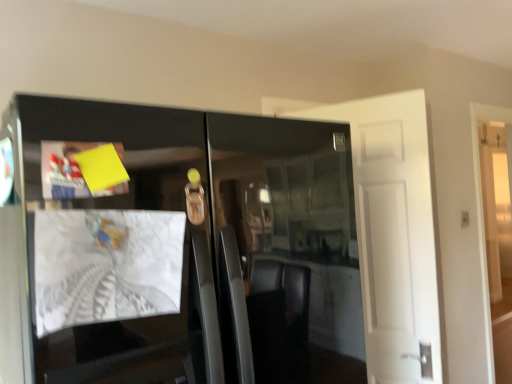
What is the approximate height of yellow paper at upper left, the first magazine from the top?

yellow paper at upper left, the first magazine from the top, is 4.24 inches in height.

At what (x,y) coordinates should I click in order to perform the action: click on white paper at left, placed as the second magazine when sorted from top to bottom. Please return your answer as a coordinate pair (x, y). Looking at the image, I should click on (106, 266).

You are a GUI agent. You are given a task and a screenshot of the screen. Output one action in this format:
    pyautogui.click(x=<x>, y=<y>)
    Task: Click on the yellow paper at upper left, the first magazine from the top
    The width and height of the screenshot is (512, 384).
    Given the screenshot: What is the action you would take?
    pyautogui.click(x=70, y=172)

How many degrees apart are the facing directions of white paper at left, arranged as the 1th magazine when ordered from the bottom, and glossy black cabinet at center?

white paper at left, arranged as the 1th magazine when ordered from the bottom, and glossy black cabinet at center are facing 9.31 degrees away from each other.

Is white paper at left, arranged as the 1th magazine when ordered from the bottom, at the left side of glossy black cabinet at center?

Yes.

From a real-world perspective, is white paper at left, placed as the second magazine when sorted from top to bottom, located beneath glossy black cabinet at center?

Incorrect, from a real-world perspective, white paper at left, placed as the second magazine when sorted from top to bottom, is higher than glossy black cabinet at center.

Between white paper at left, arranged as the 1th magazine when ordered from the bottom, and glossy black cabinet at center, which one has more height?

Standing taller between the two is glossy black cabinet at center.

Which of these two, yellow paper at upper left, the first magazine from the top, or glossy black cabinet at center, stands taller?

Standing taller between the two is glossy black cabinet at center.

Who is more distant, yellow paper at upper left, the 2th magazine positioned from the bottom, or glossy black cabinet at center?

yellow paper at upper left, the 2th magazine positioned from the bottom, is further from the camera.

Which is nearer, (95, 147) or (64, 310)?

The point (64, 310) is in front.

Is yellow paper at upper left, the first magazine from the top, oriented towards glossy black cabinet at center?

Yes, yellow paper at upper left, the first magazine from the top, is oriented towards glossy black cabinet at center.

Is white matte door at right, which ranks as the 1th door in right-to-left order, oriented towards glossy black cabinet at center?

No, white matte door at right, which ranks as the 1th door in right-to-left order, is not turned towards glossy black cabinet at center.

Is white matte door at right, which is counted as the first door, starting from the back, to the right of glossy black cabinet at center from the viewer's perspective?

Yes, white matte door at right, which is counted as the first door, starting from the back, is to the right of glossy black cabinet at center.

Which point is more distant from viewer, (510, 372) or (247, 140)?

The point (510, 372) is more distant.

Considering their positions, is white matte door at upper right, the 1th door viewed from the left, located in front of or behind white matte door at right, which is the 2th door in front-to-back order?

white matte door at upper right, the 1th door viewed from the left, is in front of white matte door at right, which is the 2th door in front-to-back order.

Looking at this image, measure the distance between white matte door at upper right, which appears as the 2th door when viewed from the right, and white matte door at right, which is the 2th door in front-to-back order.

A distance of 1.87 meters exists between white matte door at upper right, which appears as the 2th door when viewed from the right, and white matte door at right, which is the 2th door in front-to-back order.

Is white matte door at upper right, which appears as the 2th door when viewed from the right, far from white matte door at right, which is counted as the first door, starting from the back?

Absolutely, white matte door at upper right, which appears as the 2th door when viewed from the right, is distant from white matte door at right, which is counted as the first door, starting from the back.

Does white paper at left, arranged as the 1th magazine when ordered from the bottom, appear on the right side of white matte door at right, which is the 2th door from left to right?

In fact, white paper at left, arranged as the 1th magazine when ordered from the bottom, is to the left of white matte door at right, which is the 2th door from left to right.

From the image's perspective, is white paper at left, arranged as the 1th magazine when ordered from the bottom, over white matte door at right, which ranks as the 1th door in right-to-left order?

Indeed, from the image's perspective, white paper at left, arranged as the 1th magazine when ordered from the bottom, is shown above white matte door at right, which ranks as the 1th door in right-to-left order.

Based on the photo, which is nearer, (165, 248) or (480, 158)?

Point (165, 248) is closer to the camera than point (480, 158).

Where is `magazine that is the 2nd object located in front of the white matte door at right, which is the 2th door in front-to-back order`? The height and width of the screenshot is (384, 512). magazine that is the 2nd object located in front of the white matte door at right, which is the 2th door in front-to-back order is located at coordinates (106, 266).

This screenshot has height=384, width=512. I want to click on cabinetry above the white matte door at right, which is counted as the first door, starting from the back (from a real-world perspective), so [x=180, y=251].

Can you confirm if glossy black cabinet at center is smaller than white matte door at right, which is counted as the first door, starting from the back?

No.

From the image's perspective, is glossy black cabinet at center over white matte door at right, which is the 2th door from left to right?

Yes, from the image's perspective, glossy black cabinet at center is on top of white matte door at right, which is the 2th door from left to right.

Can you tell me how much glossy black cabinet at center and white matte door at right, which is counted as the first door, starting from the back, differ in facing direction?

The facing directions of glossy black cabinet at center and white matte door at right, which is counted as the first door, starting from the back, are 1.2 degrees apart.

Which is more to the right, yellow paper at upper left, the first magazine from the top, or white paper at left, arranged as the 1th magazine when ordered from the bottom?

From the viewer's perspective, white paper at left, arranged as the 1th magazine when ordered from the bottom, appears more on the right side.

Considering the sizes of objects yellow paper at upper left, the 2th magazine positioned from the bottom, and white paper at left, placed as the second magazine when sorted from top to bottom, in the image provided, who is smaller, yellow paper at upper left, the 2th magazine positioned from the bottom, or white paper at left, placed as the second magazine when sorted from top to bottom,?

yellow paper at upper left, the 2th magazine positioned from the bottom, is smaller.

From the image's perspective, is yellow paper at upper left, the 2th magazine positioned from the bottom, on top of white paper at left, placed as the second magazine when sorted from top to bottom?

Yes, from the image's perspective, yellow paper at upper left, the 2th magazine positioned from the bottom, is on top of white paper at left, placed as the second magazine when sorted from top to bottom.

Identify the location of magazine that is the 1st object above the glossy black cabinet at center (from a real-world perspective). (106, 266).

There is a glossy black cabinet at center. Identify the location of the 2nd magazine above it (from the image's perspective). The width and height of the screenshot is (512, 384). (70, 172).

When comparing their distances from white matte door at right, which is the 2th door in front-to-back order, does white matte door at upper right, which ranks as the first door in front-to-back order, or yellow paper at upper left, the 2th magazine positioned from the bottom, seem further?

yellow paper at upper left, the 2th magazine positioned from the bottom.

Which object lies further to the anchor point yellow paper at upper left, the first magazine from the top, white matte door at right, which is counted as the first door, starting from the back, or white matte door at upper right, the 1th door viewed from the left?

white matte door at right, which is counted as the first door, starting from the back, is positioned further to the anchor yellow paper at upper left, the first magazine from the top.

Considering their positions, is glossy black cabinet at center positioned closer to white matte door at right, which is the 2th door from left to right, than yellow paper at upper left, the 2th magazine positioned from the bottom?

Among the two, glossy black cabinet at center is located nearer to white matte door at right, which is the 2th door from left to right.

Based on the photo, when comparing their distances from white paper at left, placed as the second magazine when sorted from top to bottom, does glossy black cabinet at center or white matte door at upper right, which appears as the 2th door when viewed from the right, seem further?

white matte door at upper right, which appears as the 2th door when viewed from the right.

From the image, which object appears to be farther from white matte door at upper right, which appears as the 2th door when viewed from the right, white paper at left, arranged as the 1th magazine when ordered from the bottom, or yellow paper at upper left, the first magazine from the top?

yellow paper at upper left, the first magazine from the top, is further to white matte door at upper right, which appears as the 2th door when viewed from the right.

Estimate the real-world distances between objects in this image. Which object is further from glossy black cabinet at center, white matte door at right, which is counted as the first door, starting from the back, or white matte door at upper right, which ranks as the first door in front-to-back order?

white matte door at right, which is counted as the first door, starting from the back.

Considering their positions, is white matte door at right, which ranks as the 1th door in right-to-left order, positioned further to yellow paper at upper left, the 2th magazine positioned from the bottom, than white paper at left, placed as the second magazine when sorted from top to bottom?

The object further to yellow paper at upper left, the 2th magazine positioned from the bottom, is white matte door at right, which ranks as the 1th door in right-to-left order.

Which object lies further to the anchor point white paper at left, arranged as the 1th magazine when ordered from the bottom, yellow paper at upper left, the 2th magazine positioned from the bottom, or glossy black cabinet at center?

glossy black cabinet at center.

This screenshot has height=384, width=512. Identify the location of cabinetry between white paper at left, arranged as the 1th magazine when ordered from the bottom, and white matte door at right, which is the 2th door in front-to-back order, in the horizontal direction. (180, 251).

Where is `magazine positioned between white paper at left, arranged as the 1th magazine when ordered from the bottom, and white matte door at upper right, which appears as the 2th door when viewed from the right, from near to far`? magazine positioned between white paper at left, arranged as the 1th magazine when ordered from the bottom, and white matte door at upper right, which appears as the 2th door when viewed from the right, from near to far is located at coordinates (70, 172).

What are the coordinates of `door between yellow paper at upper left, the 2th magazine positioned from the bottom, and white matte door at right, which is counted as the first door, starting from the back, from left to right` in the screenshot? It's located at (393, 233).

Find the location of a particular element. The height and width of the screenshot is (384, 512). cabinetry located between yellow paper at upper left, the 2th magazine positioned from the bottom, and white matte door at right, which is counted as the first door, starting from the back, in the left-right direction is located at coordinates (180, 251).